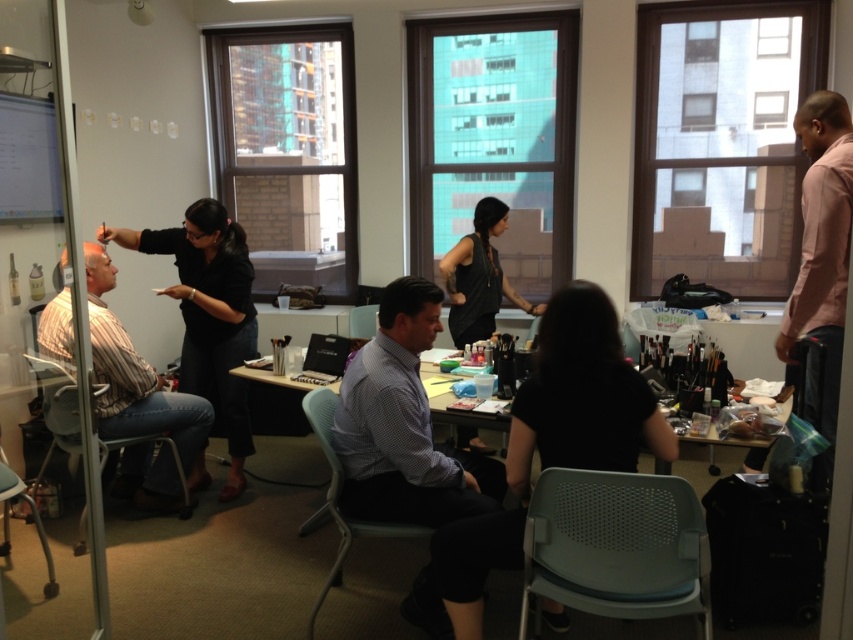
Looking at this image, between checkered fabric shirt at center and matte plastic chair at left, which one appears on the left side from the viewer's perspective?

matte plastic chair at left is more to the left.

Can you confirm if checkered fabric shirt at center is positioned below matte plastic chair at left?

Incorrect, checkered fabric shirt at center is not positioned below matte plastic chair at left.

Between point (427, 300) and point (112, 451), which one is positioned in front?

Point (427, 300) is more forward.

Find the location of a particular element. This screenshot has width=853, height=640. checkered fabric shirt at center is located at coordinates (403, 426).

Is point (821, 109) less distant than point (473, 218)?

Yes, it is in front of point (473, 218).

Is brown matte hair at upper right in front of black shiny hair at center?

Result: Yes.

From the picture: Measure the distance between brown matte hair at upper right and camera.

brown matte hair at upper right and camera are 2.58 meters apart from each other.

This screenshot has height=640, width=853. Identify the location of brown matte hair at upper right. (822, 112).

Consider the image. Between black matte hair at upper left and brown matte hair at upper right, which one is positioned higher?

brown matte hair at upper right is higher up.

Where is `black matte hair at upper left`? This screenshot has width=853, height=640. black matte hair at upper left is located at coordinates (215, 225).